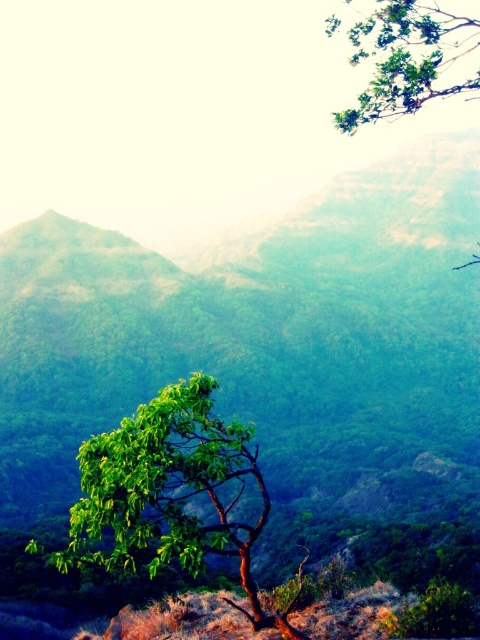
You are a hiker planning to take a photo of both the green leafy tree at center and the green leafy tree at upper right. Which tree should you position closer to the camera to ensure both are fully visible in the frame?

You should position the green leafy tree at upper right closer to the camera because it is thicker than the green leafy tree at center, allowing both trees to fit within the frame.

You are standing in the mountain landscape and want to take a photo of the green leafy tree at center. If your camera has a maximum zoom range of 10 meters, will you be able to capture the tree clearly without moving closer?

The distance between you and the green leafy tree at center is 11.60 meters. Since your camera can only zoom up to 10 meters, you will need to move closer to the tree to capture it clearly.

You are a hiker planning to set up a campsite in the serene mountainous landscape described. You want to ensure your campsite is positioned at point [170,493]. Considering the solitary tree with a robust trunk and dense canopy at the center of the image, will the tree provide adequate shade for your campsite at that location?

The point [170,493] is where the green leafy tree at center is located. Since the tree has a dense canopy of vibrant green leaves, it will provide adequate shade for the campsite positioned there.